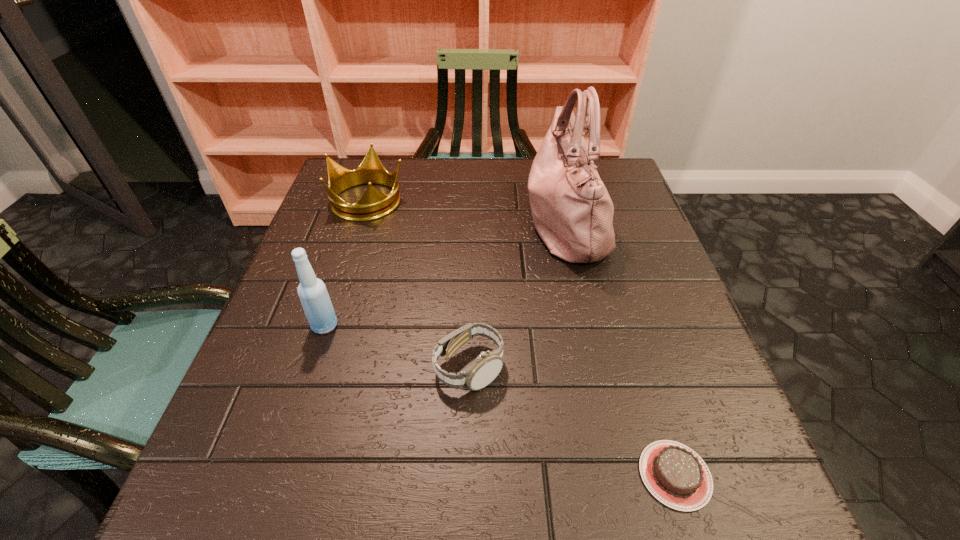
The image size is (960, 540). In the image, there is a desktop. Identify the location of vacant space at the near left corner. (261, 496).

Find the location of a particular element. vacant position at the far right corner of the desktop is located at coordinates (598, 163).

Where is `free point between the third nearest object and the nearest object`? The image size is (960, 540). free point between the third nearest object and the nearest object is located at coordinates (500, 400).

This screenshot has height=540, width=960. I want to click on vacant area that lies between the crown and the handbag, so click(467, 211).

Where is `free point between the tallest object and the shortest object`? free point between the tallest object and the shortest object is located at coordinates (620, 348).

Locate an element on the screen. empty space between the bottle and the tallest object is located at coordinates (445, 274).

Image resolution: width=960 pixels, height=540 pixels. In order to click on free space between the shortest object and the fourth tallest object in this screenshot , I will do `click(572, 421)`.

Where is `free space between the watch and the chocolate cake`? This screenshot has width=960, height=540. free space between the watch and the chocolate cake is located at coordinates (572, 421).

Find the location of a particular element. The width and height of the screenshot is (960, 540). vacant space that is in between the tallest object and the watch is located at coordinates (516, 295).

Where is `empty space between the chocolate cake and the tallest object`? empty space between the chocolate cake and the tallest object is located at coordinates (620, 348).